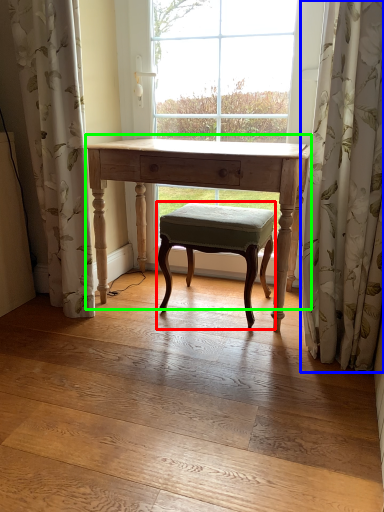
Question: Considering the real-world distances, which object is closest to stool (highlighted by a red box)? curtain (highlighted by a blue box) or table (highlighted by a green box).

Choices:
 (A) curtain
 (B) table

Answer: (B)